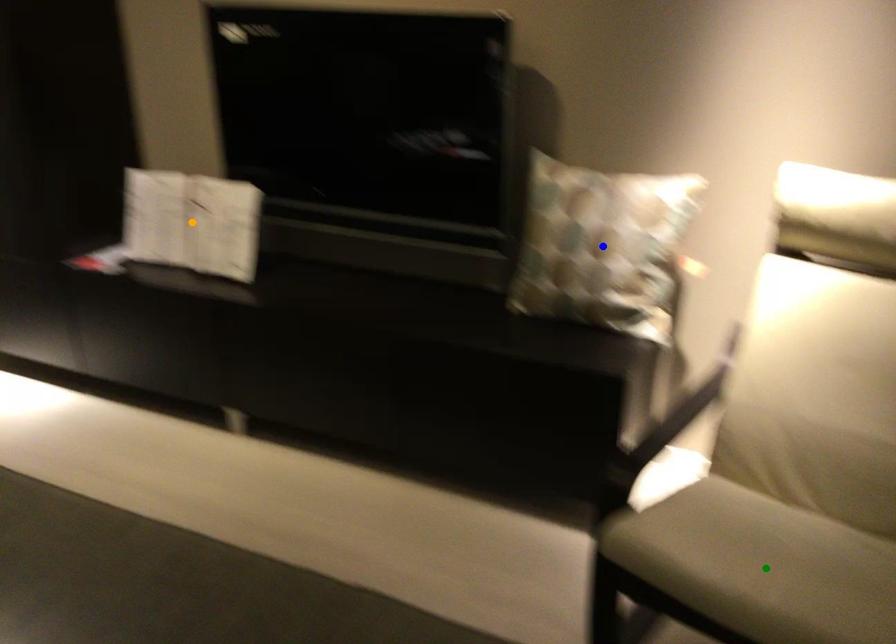
Order these from nearest to farthest:
blue point, green point, orange point

green point < blue point < orange point